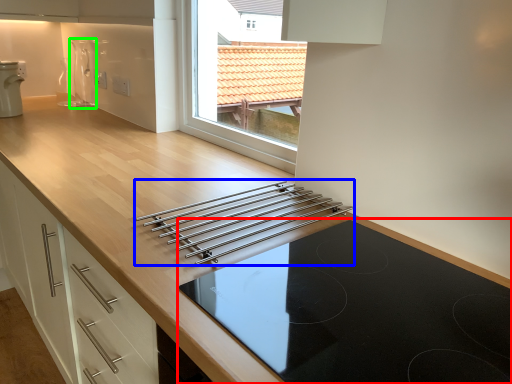
Question: Which object is the farthest from gas stove (highlighted by a red box)? Choose among these: kitchen appliance (highlighted by a blue box) or appliance (highlighted by a green box).

Choices:
 (A) kitchen appliance
 (B) appliance

Answer: (B)